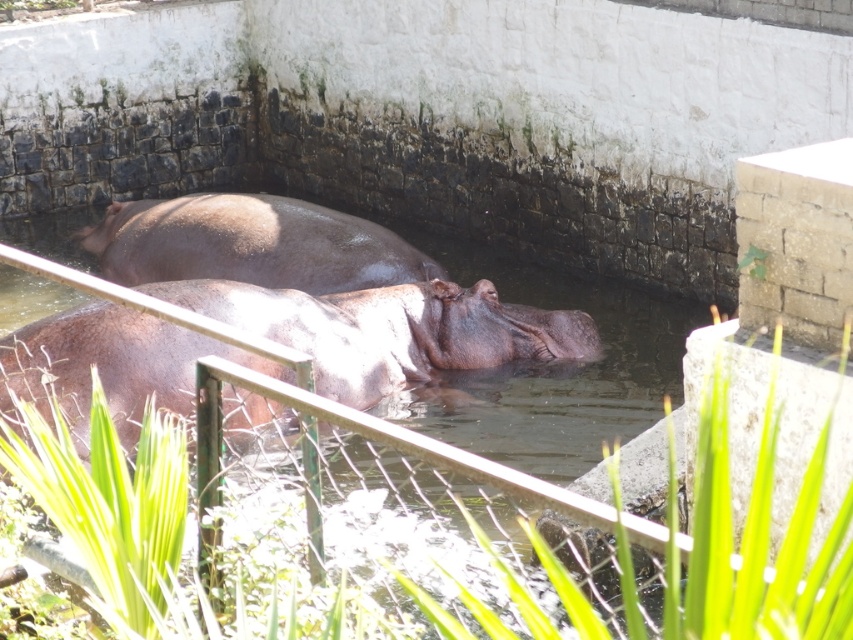
You are a zookeeper standing at the camera position. You need to feed the brown matte hippo at center. The food you are holding can be thrown 4 meters. Will you be able to reach the hippo?

The distance between the brown matte hippo at center and the camera is 3.92 meters. Since the food can be thrown 4 meters, you can reach the hippo.

You are standing in front of the enclosure and want to take a photo of both hippos. Which hippo will appear larger in your photo, the brown matte hippo at center or the shiny brown hippo at upper center?

The brown matte hippo at center will appear larger in the photo because it is closer to the viewer than the shiny brown hippo at upper center.

You are a zookeeper observing the hippos in their enclosure. You notice the brown matte water at center and the shiny brown hippo at upper center. Which object is taller in this scene?

The brown matte water at center is taller than the shiny brown hippo at upper center according to the description.